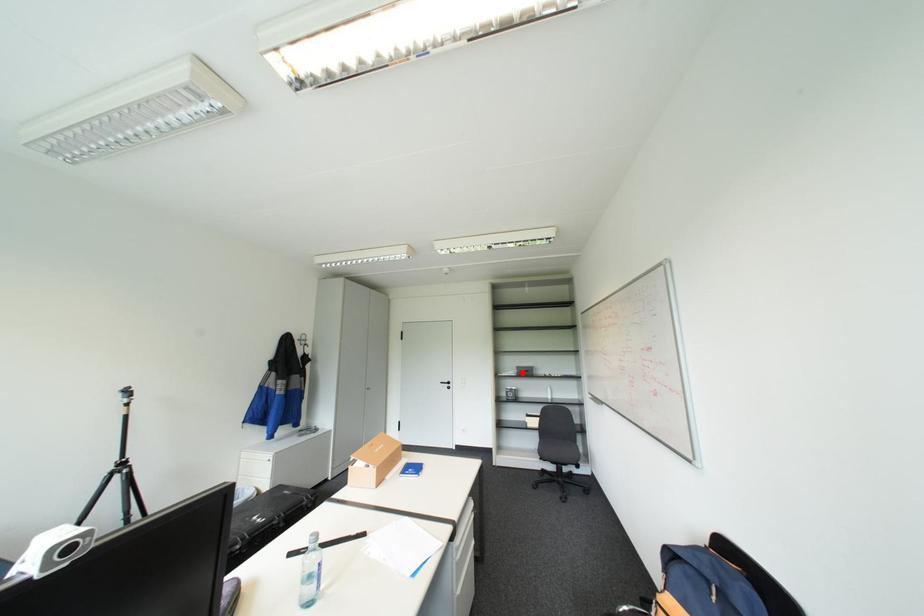
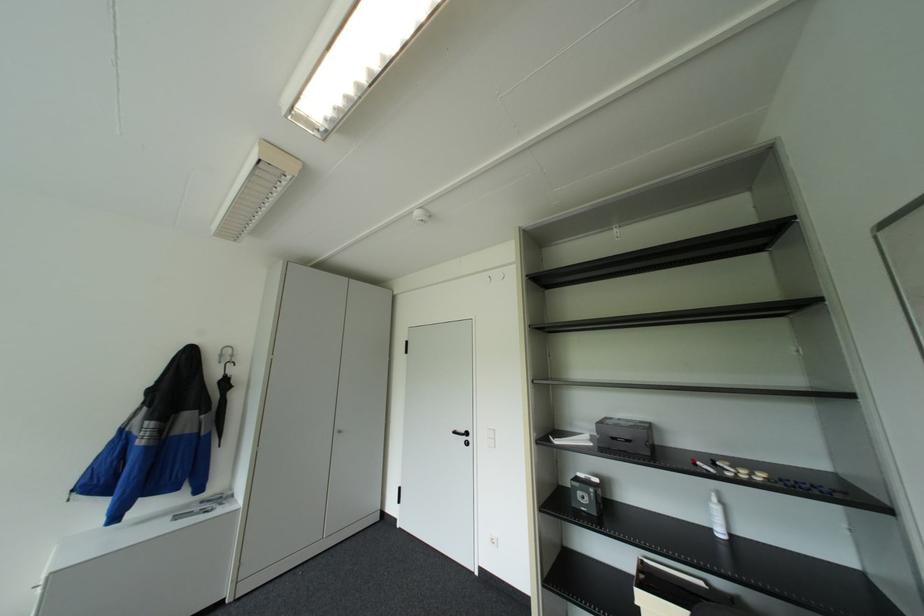
In the second image, find the point that corresponds to the highlighted location in the first image.

(600, 443)